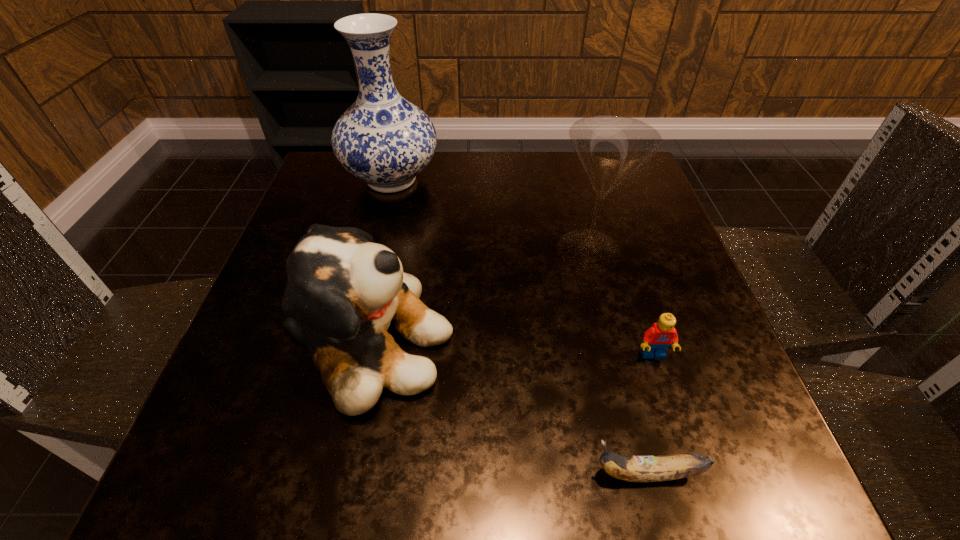
At what (x,y) coordinates should I click in order to perform the action: click on banana present at the right edge. Please return your answer as a coordinate pair (x, y). The width and height of the screenshot is (960, 540). Looking at the image, I should click on (668, 467).

What are the coordinates of `object that is at the far left corner` in the screenshot? It's located at (383, 139).

Locate an element on the screen. object at the near right corner is located at coordinates (668, 467).

Where is `vacant area at the far edge`? vacant area at the far edge is located at coordinates (510, 151).

At what (x,y) coordinates should I click in order to perform the action: click on vacant space at the near edge. Please return your answer as a coordinate pair (x, y). Image resolution: width=960 pixels, height=540 pixels. Looking at the image, I should click on (403, 429).

Locate an element on the screen. Image resolution: width=960 pixels, height=540 pixels. vacant space at the left edge of the desktop is located at coordinates pyautogui.click(x=340, y=210).

At what (x,y) coordinates should I click in order to perform the action: click on vacant space at the right edge of the desktop. Please return your answer as a coordinate pair (x, y). Image resolution: width=960 pixels, height=540 pixels. Looking at the image, I should click on (645, 389).

Where is `vacant space at the far left corner`? The height and width of the screenshot is (540, 960). vacant space at the far left corner is located at coordinates (348, 200).

Find the location of `free space at the near left corner of the desktop`. free space at the near left corner of the desktop is located at coordinates (222, 453).

At what (x,y) coordinates should I click in order to perform the action: click on free space at the far right corner of the desktop. Please return your answer as a coordinate pair (x, y). Looking at the image, I should click on (637, 181).